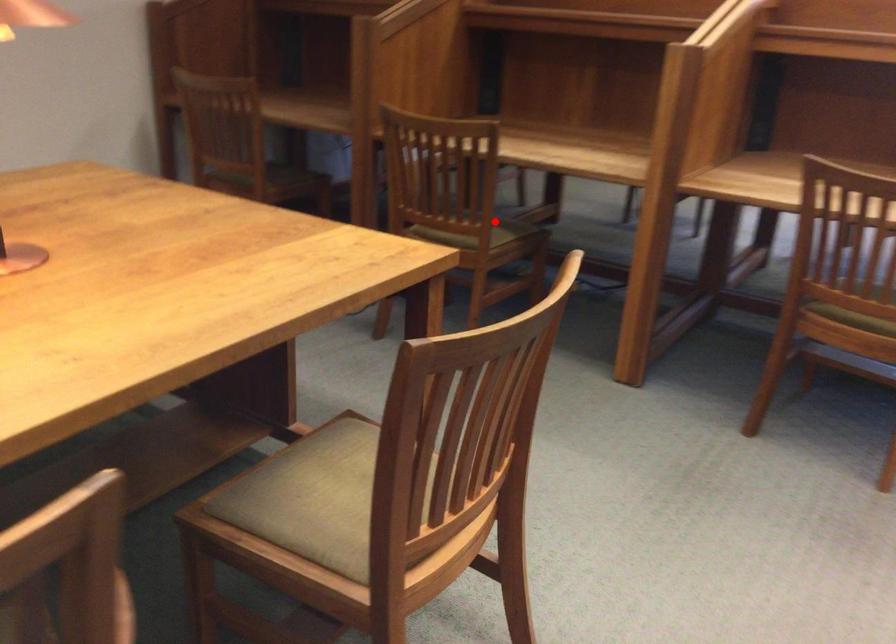
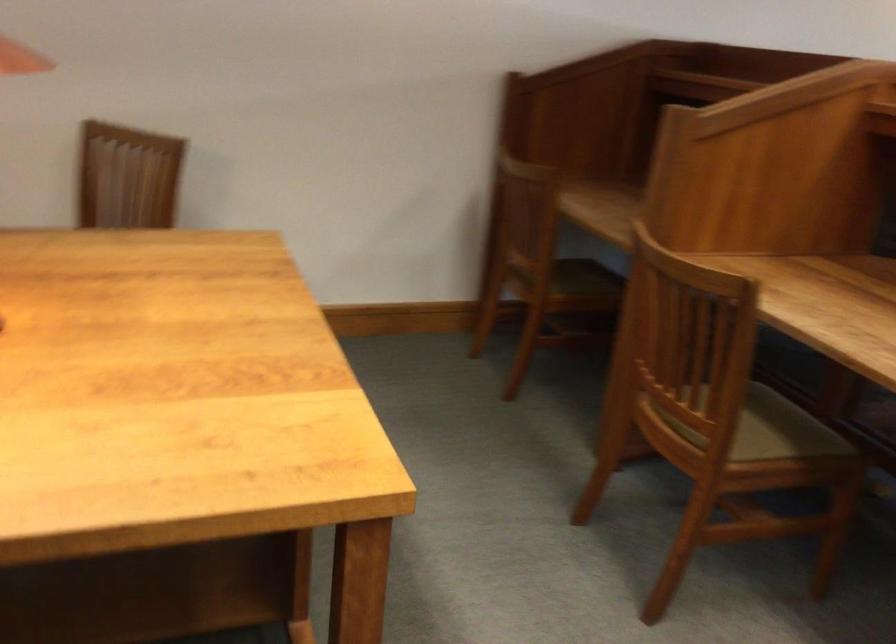
Question: I am providing you with two images of the same scene from different viewpoints. A red point is shown in image1. For the corresponding object point in image2, is it positioned nearer or farther from the camera?

Choices:
 (A) Nearer
 (B) Farther

Answer: (A)